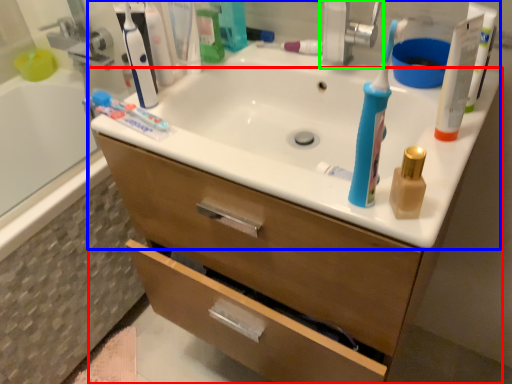
Question: Based on their relative distances, which object is farther from bathroom cabinet (highlighted by a red box)? Choose from sink (highlighted by a blue box) and faucet (highlighted by a green box).

Choices:
 (A) sink
 (B) faucet

Answer: (B)